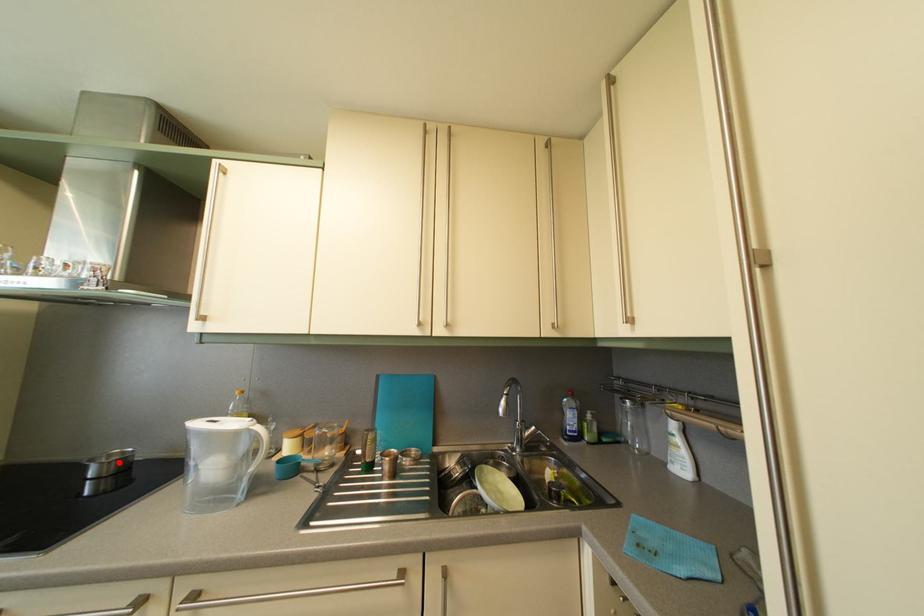
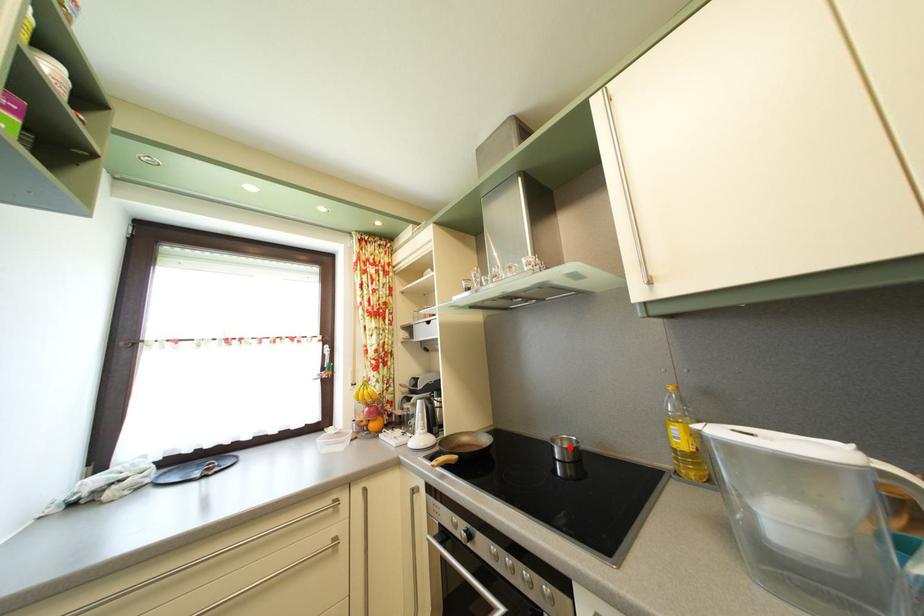
I am providing you with two images of the same scene from different viewpoints. A red point is marked on the first image and another point is marked on the second image. Is the marked point in image1 the same physical position as the marked point in image2?

Yes